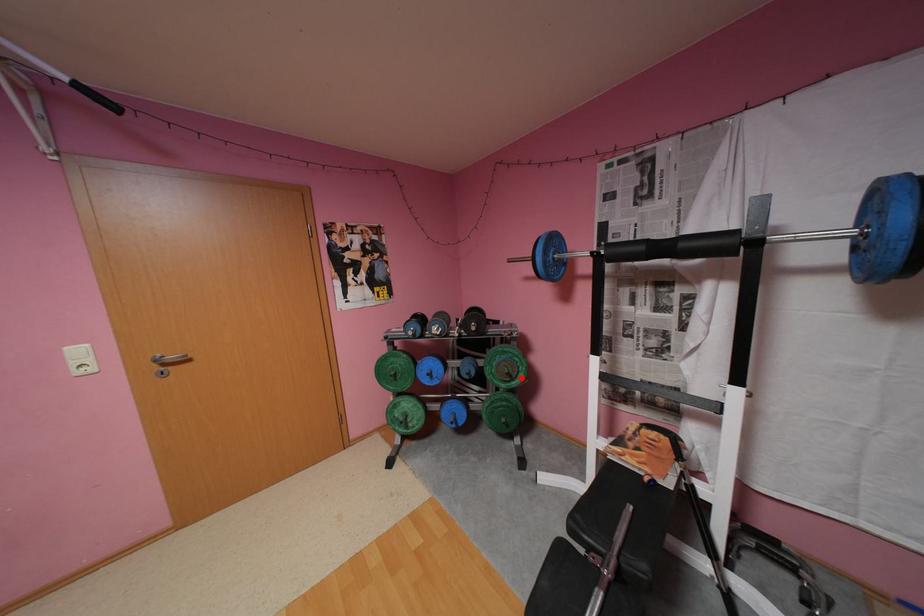
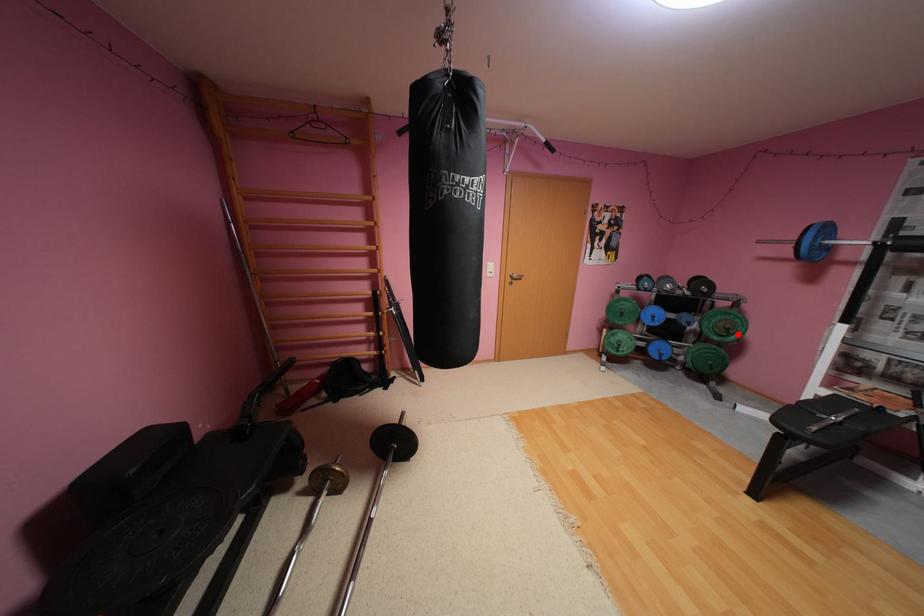
I am providing you with two images of the same scene from different viewpoints. A red point is marked on the first image and another point is marked on the second image. Are the points marked in image1 and image2 representing the same 3D position?

Yes